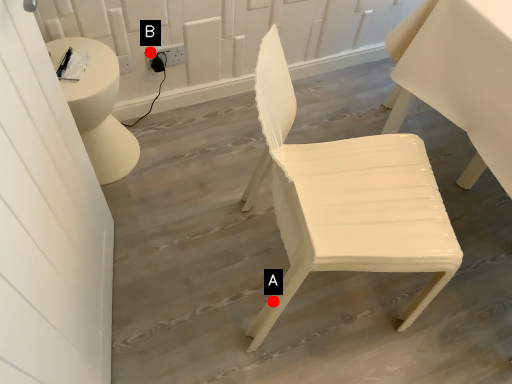
Question: Two points are circled on the image, labeled by A and B beside each circle. Which point is closer to the camera?

Choices:
 (A) A is closer
 (B) B is closer

Answer: (A)